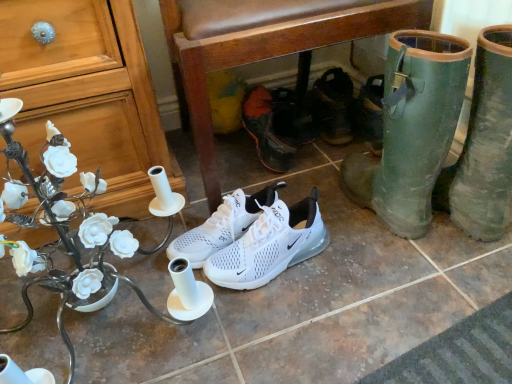
Describe the element at coordinates (88, 94) in the screenshot. The image size is (512, 384). I see `matte wood cabinet at left` at that location.

This screenshot has height=384, width=512. What do you see at coordinates (271, 125) in the screenshot? I see `white mesh shoe at center, the second footwear from the back` at bounding box center [271, 125].

What do you see at coordinates (65, 228) in the screenshot?
I see `matte white desk at center` at bounding box center [65, 228].

You are a GUI agent. You are given a task and a screenshot of the screen. Output one action in this format:
    pyautogui.click(x=<x>, y=<y>)
    Task: Click on the black leather sandals at center, acting as the 1th footwear starting from the back
    
    Given the screenshot: What is the action you would take?
    pyautogui.click(x=332, y=106)

Describe the element at coordinates (263, 46) in the screenshot. This screenshot has height=384, width=512. I see `brown leather chair at center` at that location.

Where is `brown leather chair at center`? The image size is (512, 384). brown leather chair at center is located at coordinates (263, 46).

Locate an element on the screen. The image size is (512, 384). white mesh sneakers at center, arranged as the 3th footwear when viewed from the front is located at coordinates (223, 225).

Can you confirm if white mesh shoe at center, the second footwear from the back, is wider than black leather sandals at center, placed as the fifth footwear when sorted from front to back?

Yes, white mesh shoe at center, the second footwear from the back, is wider than black leather sandals at center, placed as the fifth footwear when sorted from front to back.

Based on the photo, from the image's perspective, is white mesh shoe at center, the second footwear from the back, above or below black leather sandals at center, acting as the 1th footwear starting from the back?

white mesh shoe at center, the second footwear from the back, is below black leather sandals at center, acting as the 1th footwear starting from the back.

Considering the relative positions of white mesh shoe at center, arranged as the 4th footwear when viewed from the front, and black leather sandals at center, placed as the fifth footwear when sorted from front to back, in the image provided, is white mesh shoe at center, arranged as the 4th footwear when viewed from the front, in front of black leather sandals at center, placed as the fifth footwear when sorted from front to back,?

Yes.

What are the coordinates of `chair that is behind the matte white desk at center` in the screenshot? It's located at (263, 46).

From the picture: Is brown leather chair at center at the back of matte white desk at center?

No, matte white desk at center's orientation is not away from brown leather chair at center.

Is matte white desk at center closer to camera compared to brown leather chair at center?

That is True.

Is black leather sandals at center, acting as the 1th footwear starting from the back, taller or shorter than white mesh shoe at center, the second footwear from the back?

Considering their sizes, black leather sandals at center, acting as the 1th footwear starting from the back, has less height than white mesh shoe at center, the second footwear from the back.

How distant is black leather sandals at center, acting as the 1th footwear starting from the back, from white mesh shoe at center, the second footwear from the back?

black leather sandals at center, acting as the 1th footwear starting from the back, is 6.45 inches from white mesh shoe at center, the second footwear from the back.

Is black leather sandals at center, acting as the 1th footwear starting from the back, oriented towards white mesh shoe at center, arranged as the 4th footwear when viewed from the front?

No, black leather sandals at center, acting as the 1th footwear starting from the back, does not turn towards white mesh shoe at center, arranged as the 4th footwear when viewed from the front.

How much distance is there between matte wood cabinet at left and brown leather chair at center?

The distance of matte wood cabinet at left from brown leather chair at center is 9.37 inches.

In order to click on chair behind the matte wood cabinet at left in this screenshot , I will do `click(263, 46)`.

Considering the sizes of objects matte wood cabinet at left and brown leather chair at center in the image provided, who is thinner, matte wood cabinet at left or brown leather chair at center?

matte wood cabinet at left is thinner.

Who is taller, matte wood cabinet at left or brown leather chair at center?

With more height is matte wood cabinet at left.

From a real-world perspective, who is located lower, matte white desk at center or green rubber boots at lower right, marked as the fifth footwear in a back-to-front arrangement?

green rubber boots at lower right, marked as the fifth footwear in a back-to-front arrangement.

From the image's perspective, is matte white desk at center positioned above or below green rubber boots at lower right, the first footwear from the front?

Clearly, from the image's perspective, matte white desk at center is below green rubber boots at lower right, the first footwear from the front.

Measure the distance between matte white desk at center and green rubber boots at lower right, marked as the fifth footwear in a back-to-front arrangement.

matte white desk at center and green rubber boots at lower right, marked as the fifth footwear in a back-to-front arrangement, are 23.77 inches apart.

Can you tell me how much matte white desk at center and green rubber boots at lower right, marked as the fifth footwear in a back-to-front arrangement, differ in facing direction?

180 degrees separate the facing orientations of matte white desk at center and green rubber boots at lower right, marked as the fifth footwear in a back-to-front arrangement.

Is matte wood cabinet at left at the left side of black leather sandals at center, acting as the 1th footwear starting from the back?

Correct, you'll find matte wood cabinet at left to the left of black leather sandals at center, acting as the 1th footwear starting from the back.

Between matte wood cabinet at left and black leather sandals at center, placed as the fifth footwear when sorted from front to back, which one has larger size?

With larger size is matte wood cabinet at left.

Looking at this image, is matte wood cabinet at left next to black leather sandals at center, placed as the fifth footwear when sorted from front to back?

No.

Can you confirm if matte wood cabinet at left is taller than black leather sandals at center, acting as the 1th footwear starting from the back?

Yes, matte wood cabinet at left is taller than black leather sandals at center, acting as the 1th footwear starting from the back.

In terms of height, does white mesh shoe at center, arranged as the 4th footwear when viewed from the front, look taller or shorter compared to white mesh sneakers at center, marked as the third footwear in a back-to-front arrangement?

white mesh shoe at center, arranged as the 4th footwear when viewed from the front, is taller than white mesh sneakers at center, marked as the third footwear in a back-to-front arrangement.

Does white mesh shoe at center, the second footwear from the back, appear on the left side of white mesh sneakers at center, arranged as the 3th footwear when viewed from the front?

No.

From the image's perspective, which object appears higher, white mesh shoe at center, the second footwear from the back, or white mesh sneakers at center, marked as the third footwear in a back-to-front arrangement?

From the image's view, white mesh shoe at center, the second footwear from the back, is above.

Where is `the 1st footwear below the black leather sandals at center, acting as the 1th footwear starting from the back (from the image's perspective)`? The width and height of the screenshot is (512, 384). the 1st footwear below the black leather sandals at center, acting as the 1th footwear starting from the back (from the image's perspective) is located at coordinates (271, 125).

I want to click on chair located above the matte white desk at center (from a real-world perspective), so click(x=263, y=46).

In the scene shown: From the image, which object appears to be nearer to matte white desk at center, matte wood cabinet at left or white mesh sneakers at center, arranged as the 3th footwear when viewed from the front?

matte wood cabinet at left is positioned closer to the anchor matte white desk at center.

Considering their positions, is white mesh shoe at center, arranged as the 4th footwear when viewed from the front, positioned further to matte wood cabinet at left than white mesh sneakers at center, the 4th footwear from the back?

white mesh shoe at center, arranged as the 4th footwear when viewed from the front, lies further to matte wood cabinet at left than the other object.

When comparing their distances from matte white desk at center, does green rubber boots at lower right, the first footwear from the front, or black leather sandals at center, placed as the fifth footwear when sorted from front to back, seem closer?

green rubber boots at lower right, the first footwear from the front, is closer to matte white desk at center.

When comparing their distances from white mesh sneakers at center, the 2th footwear viewed from the front, does matte white desk at center or white mesh shoe at center, the second footwear from the back, seem further?

The object further to white mesh sneakers at center, the 2th footwear viewed from the front, is white mesh shoe at center, the second footwear from the back.

Estimate the real-world distances between objects in this image. Which object is closer to white mesh sneakers at center, the 4th footwear from the back, black leather sandals at center, acting as the 1th footwear starting from the back, or green rubber boots at lower right, the first footwear from the front?

green rubber boots at lower right, the first footwear from the front, is positioned closer to the anchor white mesh sneakers at center, the 4th footwear from the back.

Estimate the real-world distances between objects in this image. Which object is closer to white mesh sneakers at center, the 4th footwear from the back, matte white desk at center or green rubber boots at lower right, the first footwear from the front?

The object closer to white mesh sneakers at center, the 4th footwear from the back, is green rubber boots at lower right, the first footwear from the front.

Looking at the image, which one is located closer to white mesh sneakers at center, arranged as the 3th footwear when viewed from the front, white mesh sneakers at center, the 2th footwear viewed from the front, or black leather sandals at center, placed as the fifth footwear when sorted from front to back?

white mesh sneakers at center, the 2th footwear viewed from the front, lies closer to white mesh sneakers at center, arranged as the 3th footwear when viewed from the front, than the other object.

Which object lies nearer to the anchor point green rubber boots at lower right, the first footwear from the front, white mesh sneakers at center, arranged as the 3th footwear when viewed from the front, or white mesh shoe at center, the second footwear from the back?

white mesh sneakers at center, arranged as the 3th footwear when viewed from the front.

Where is `chair located between matte wood cabinet at left and green rubber boots at lower right, the first footwear from the front, in the left-right direction`? This screenshot has height=384, width=512. chair located between matte wood cabinet at left and green rubber boots at lower right, the first footwear from the front, in the left-right direction is located at coordinates (263, 46).

The image size is (512, 384). I want to click on chair situated between matte white desk at center and green rubber boots at lower right, the first footwear from the front, from left to right, so click(x=263, y=46).

This screenshot has height=384, width=512. Find the location of `chair between green rubber boots at lower right, marked as the fifth footwear in a back-to-front arrangement, and black leather sandals at center, acting as the 1th footwear starting from the back, in the front-back direction`. chair between green rubber boots at lower right, marked as the fifth footwear in a back-to-front arrangement, and black leather sandals at center, acting as the 1th footwear starting from the back, in the front-back direction is located at coordinates (263, 46).

The width and height of the screenshot is (512, 384). I want to click on footwear between white mesh sneakers at center, the 2th footwear viewed from the front, and white mesh shoe at center, arranged as the 4th footwear when viewed from the front, along the z-axis, so click(223, 225).